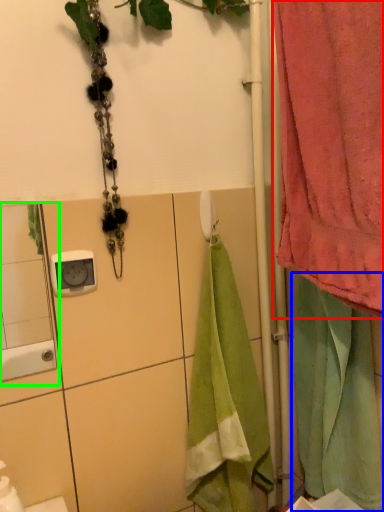
Question: Considering the real-world distances, which object is closest to curtain (highlighted by a red box)? beach towel (highlighted by a blue box) or mirror (highlighted by a green box).

Choices:
 (A) beach towel
 (B) mirror

Answer: (A)